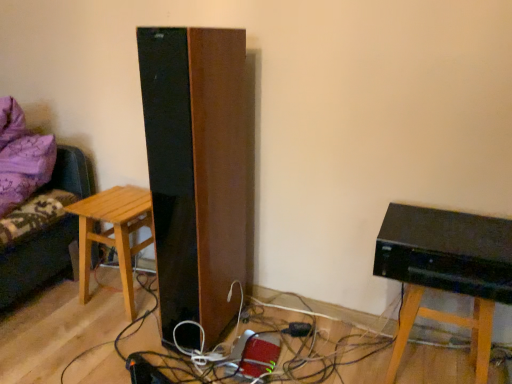
At what (x,y) coordinates should I click in order to perform the action: click on blank space to the left of black glossy computer at lower right. Please return your answer as a coordinate pair (x, y). The height and width of the screenshot is (384, 512). Looking at the image, I should click on (344, 356).